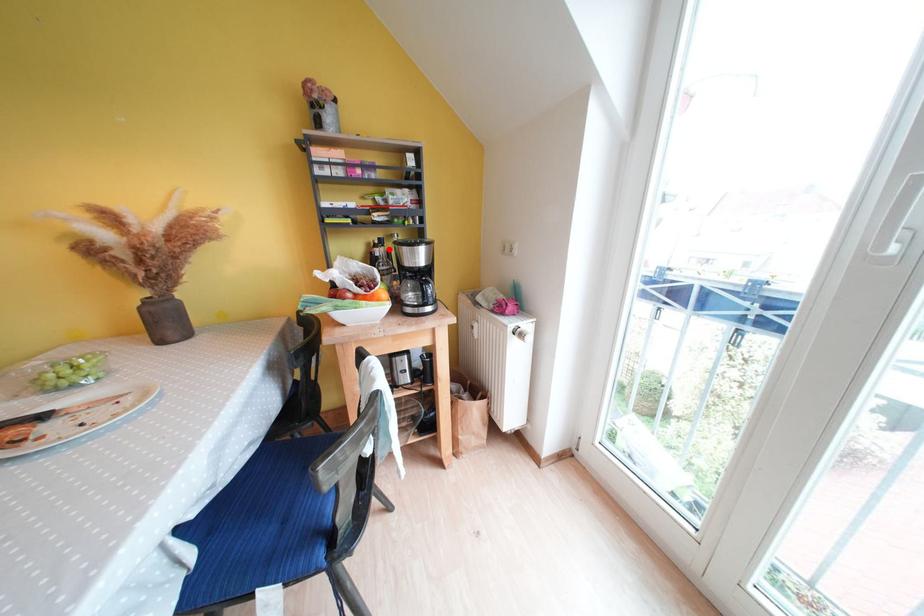
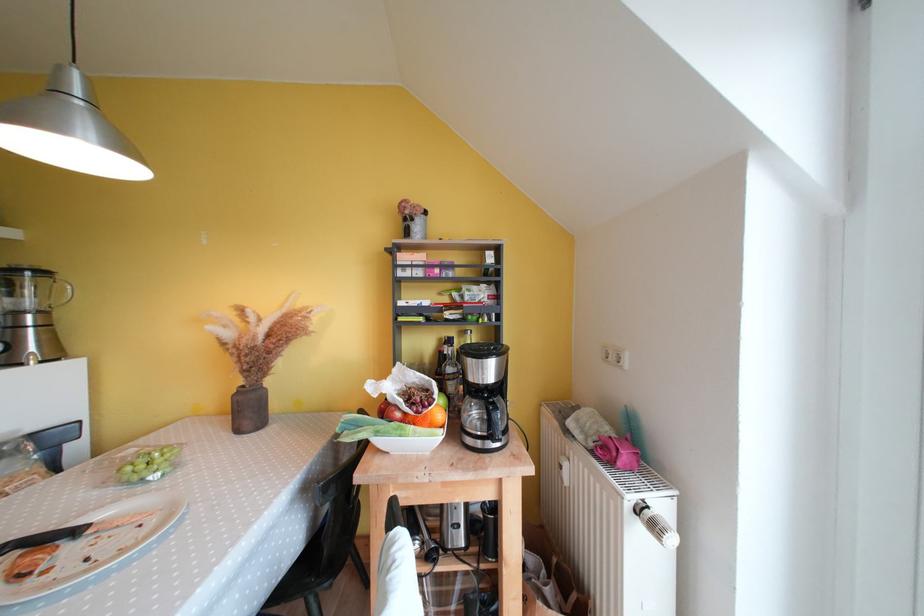
Question: I am providing you with two images of the same scene from different viewpoints. A red point is marked on the first image. At the location where the point appears in image 1, is it still visible in image 2?

Choices:
 (A) Yes
 (B) No

Answer: (A)